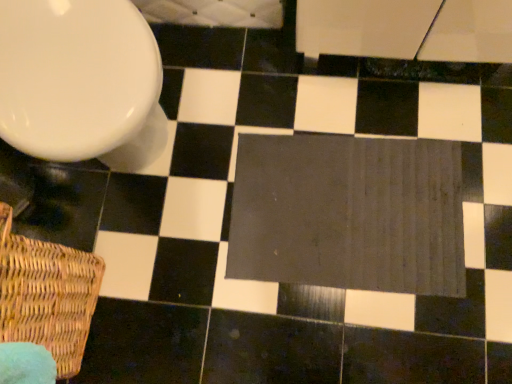
Locate an element on the screen. vacant space situated on the left part of dark gray fabric bath mat at center is located at coordinates (182, 262).